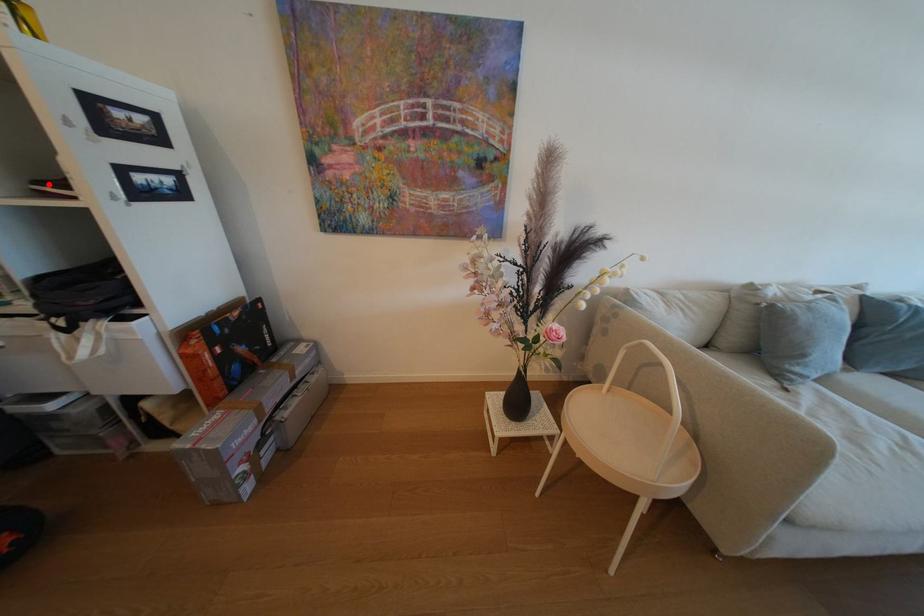
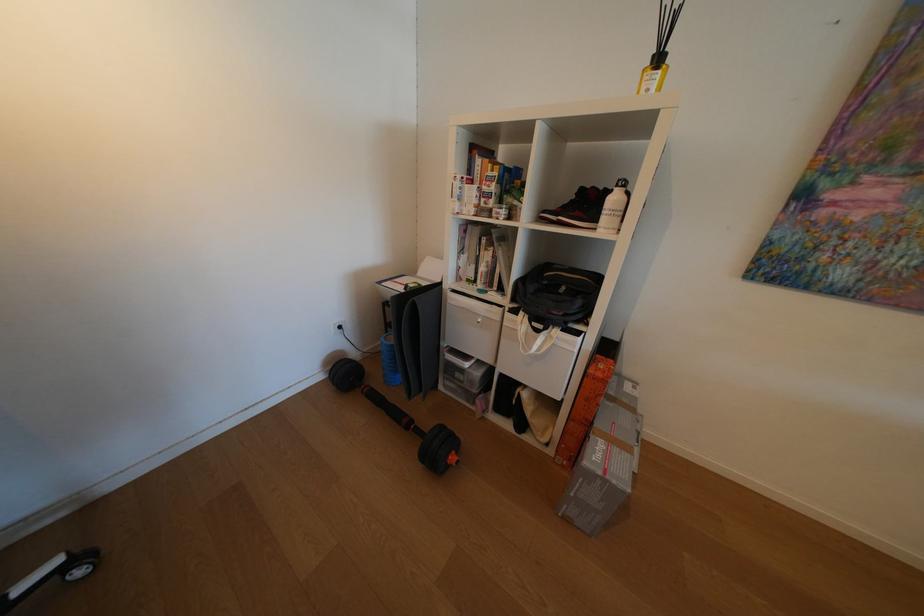
Question: A red point is marked in image1. In image2, is the corresponding 3D point closer to the camera or farther? Reply with the corresponding letter.

Choices:
 (A) The corresponding 3D point is closer.
 (B) The corresponding 3D point is farther.

Answer: (A)